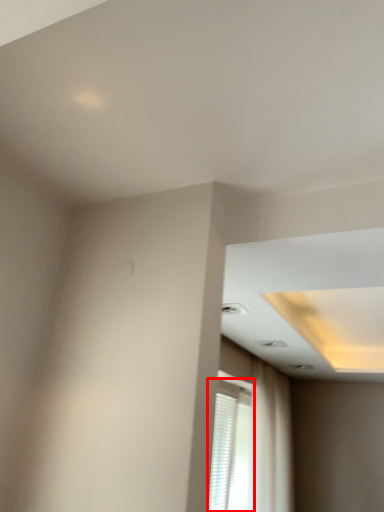
Question: In this image, where is window (annotated by the red box) located relative to curtain?

Choices:
 (A) right
 (B) left

Answer: (B)